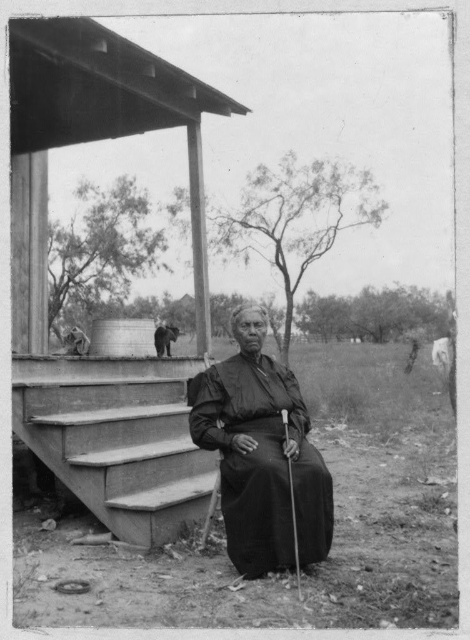
You are standing in the field and want to take a closer look at the wooden gazebo at upper center. If you walk directly towards it, how far will you have to walk?

The wooden gazebo at upper center is 8.49 meters away from the camera, so you will have to walk 8.49 meters to reach it.

You are standing at the bottom of the stairs in this rural scene. You need to place a small potted plant between the smooth concrete stairs at center and the black matte dress at center. Where should you place it so it is closer to the dress?

The small potted plant should be placed to the right of the smooth concrete stairs at center, as the stairs are to the left of the black matte dress at center, making the right side closer to the dress.

You are an artist trying to sketch this scene. You want to place the black matte dress at center accurately. According to the coordinates given, where should you position it on your drawing canvas?

The black matte dress at center should be positioned at coordinates point (261, 454) on the drawing canvas.